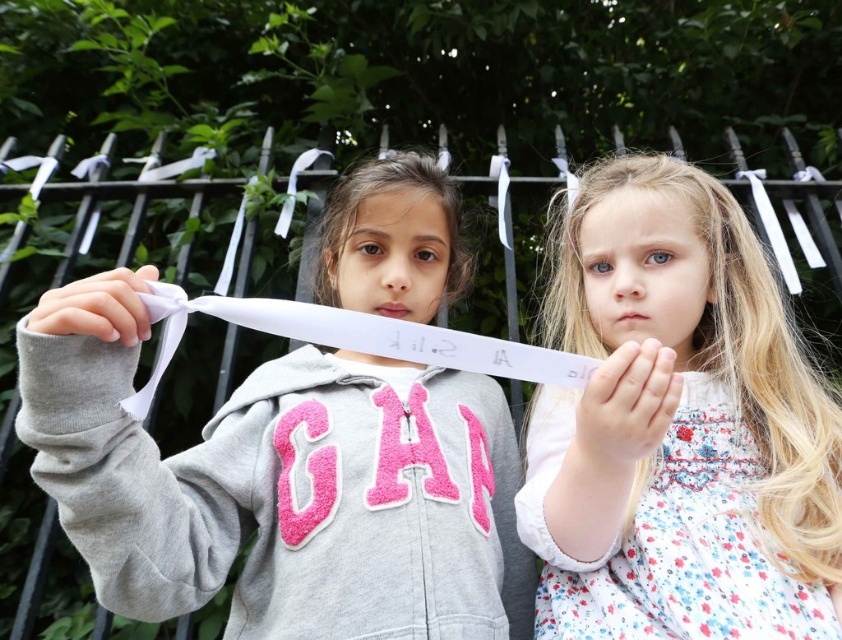
Looking at this image, you are a photographer trying to capture both the gray fleece hoodie at center and the white floral dress at center in a single frame. Based on their sizes, which clothing item will appear smaller in the photo?

The gray fleece hoodie at center will appear smaller in the photo since its width is less than the white floral dress at center.

You are a photographer trying to capture a closeup of both the gray fleece hoodie at center and the white floral dress at center in the image. Given that your camera can only focus on objects within 10 inches of each other, will you be able to get a clear photo of both?

The gray fleece hoodie at center is 9.93 inches from the white floral dress at center, which is within the 10 inch range. Therefore, the photographer can capture a clear photo of both.